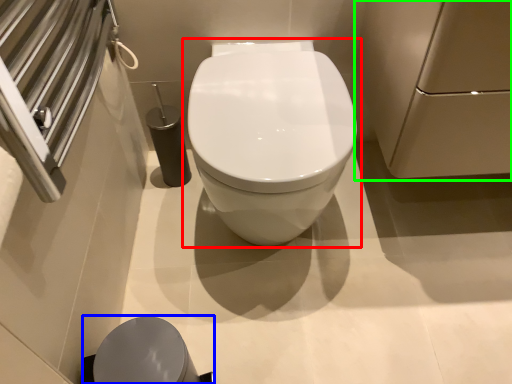
Question: Considering the real-world distances, which object is closest to toilet (highlighted by a red box)? porcelain (highlighted by a blue box) or screen door (highlighted by a green box).

Choices:
 (A) porcelain
 (B) screen door

Answer: (B)